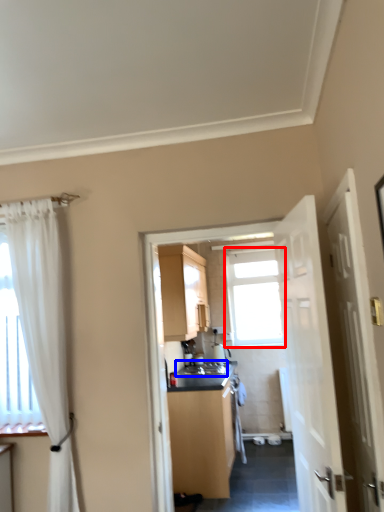
Question: Which point is further to the camera, window (highlighted by a red box) or sink (highlighted by a blue box)?

Choices:
 (A) window
 (B) sink

Answer: (A)